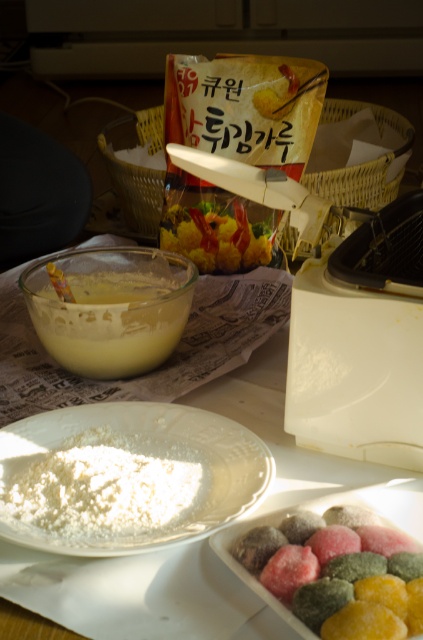
Question: Which of these objects is positioned closest to the white powdery at center?

Choices:
 (A) glossy sugar-coated dumplings at bottom right
 (B) white matte plate at center
 (C) yellow matte bowl at center

Answer: (B)

Question: Can you confirm if white powdery at center is positioned above glossy sugar-coated dumplings at bottom right?

Choices:
 (A) no
 (B) yes

Answer: (B)

Question: Which point is farther from the camera taking this photo?

Choices:
 (A) (49, 339)
 (B) (121, 440)
 (C) (411, 572)
 (D) (198, 244)

Answer: (D)

Question: Can you confirm if white matte plate at center is thinner than white powdery at center?

Choices:
 (A) yes
 (B) no

Answer: (B)

Question: Which object is positioned closest to the glossy sugar-coated dumplings at bottom right?

Choices:
 (A) yellow matte bowl at center
 (B) white powdery at center
 (C) white matte plate at center

Answer: (B)

Question: Is yellow matte bowl at center below shiny plastic container at center?

Choices:
 (A) yes
 (B) no

Answer: (A)